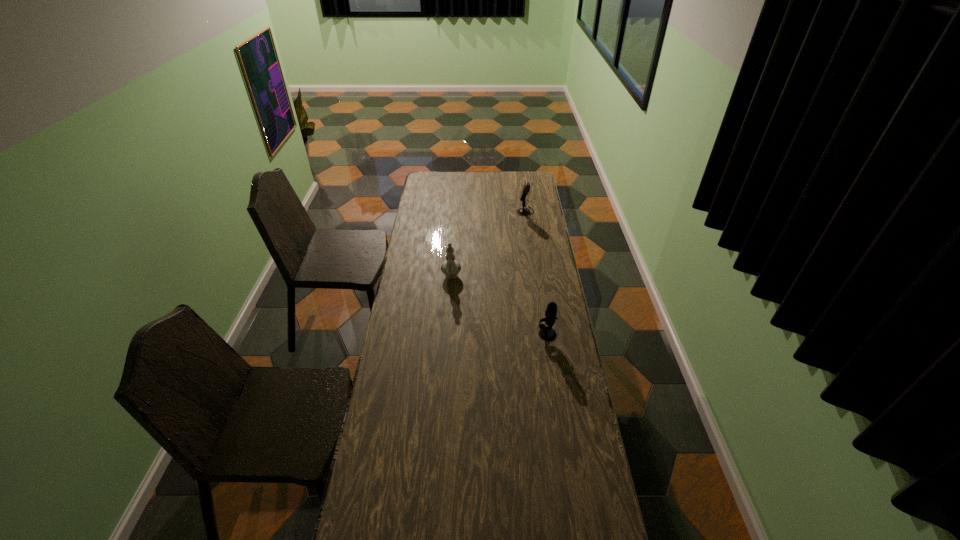
I want to click on free region at the left edge of the desktop, so click(x=428, y=221).

I want to click on free space at the right edge, so click(562, 365).

Where is `free space at the far right corner of the desktop`? The image size is (960, 540). free space at the far right corner of the desktop is located at coordinates (519, 183).

Identify the location of vacant area that lies between the nearest object and the leftmost object. The width and height of the screenshot is (960, 540). (499, 306).

You are a GUI agent. You are given a task and a screenshot of the screen. Output one action in this format:
    pyautogui.click(x=<x>, y=<y>)
    Task: Click on the empty location between the farther microphone and the nearest object
    Image resolution: width=960 pixels, height=540 pixels.
    Given the screenshot: What is the action you would take?
    pyautogui.click(x=536, y=273)

Find the location of a particular element. vacant space that's between the farther microphone and the chinaware is located at coordinates click(489, 244).

Identify which object is located as the second nearest to the farther microphone. Please provide its 2D coordinates. Your answer should be formatted as a tuple, i.e. [(x, y)], where the tuple contains the x and y coordinates of a point satisfying the conditions above.

[(547, 333)]

Where is `object that is the second nearest to the second nearest object`? object that is the second nearest to the second nearest object is located at coordinates (526, 187).

The width and height of the screenshot is (960, 540). What are the coordinates of `microphone that is the second closest to the chinaware` in the screenshot? It's located at (526, 187).

Locate an element on the screen. This screenshot has width=960, height=540. the second closest microphone to the chinaware is located at coordinates (526, 187).